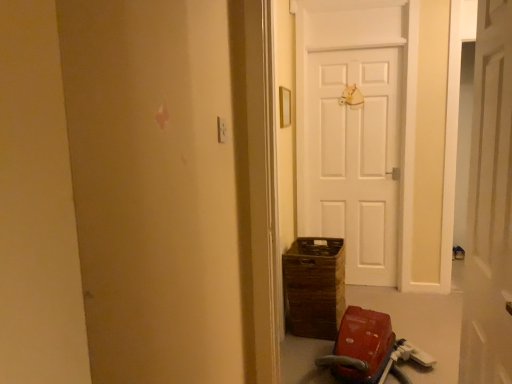
Locate an element on the screen. The width and height of the screenshot is (512, 384). red plastic baby carriage at lower right is located at coordinates (370, 349).

What do you see at coordinates (370, 349) in the screenshot?
I see `red plastic baby carriage at lower right` at bounding box center [370, 349].

The image size is (512, 384). In order to click on white matte door at center in this screenshot , I will do pyautogui.click(x=490, y=205).

This screenshot has width=512, height=384. Describe the element at coordinates (490, 205) in the screenshot. I see `white matte door at center` at that location.

This screenshot has height=384, width=512. What are the coordinates of `red plastic baby carriage at lower right` in the screenshot? It's located at (370, 349).

Does red plastic baby carriage at lower right appear on the right side of white matte door at center?

In fact, red plastic baby carriage at lower right is to the left of white matte door at center.

Considering the positions of objects red plastic baby carriage at lower right and white matte door at center in the image provided, who is in front, red plastic baby carriage at lower right or white matte door at center?

white matte door at center.

Between point (371, 337) and point (509, 192), which one is positioned behind?

The point (371, 337) is farther from the camera.

From the image's perspective, does red plastic baby carriage at lower right appear higher than white matte door at center?

Actually, red plastic baby carriage at lower right appears below white matte door at center in the image.

From a real-world perspective, is red plastic baby carriage at lower right on white matte door at center?

Incorrect, from a real-world perspective, red plastic baby carriage at lower right is lower than white matte door at center.

Considering the sizes of objects red plastic baby carriage at lower right and white matte door at center in the image provided, who is thinner, red plastic baby carriage at lower right or white matte door at center?

white matte door at center is thinner.

Who is taller, red plastic baby carriage at lower right or white matte door at center?

With more height is white matte door at center.

Is red plastic baby carriage at lower right smaller than white matte door at center?

Incorrect, red plastic baby carriage at lower right is not smaller in size than white matte door at center.

Would you say red plastic baby carriage at lower right is inside or outside white matte door at center?

red plastic baby carriage at lower right is located beyond the bounds of white matte door at center.

Are red plastic baby carriage at lower right and white matte door at center far apart?

Yes, red plastic baby carriage at lower right and white matte door at center are quite far apart.

Is red plastic baby carriage at lower right aimed at white matte door at center?

No, red plastic baby carriage at lower right does not turn towards white matte door at center.

Can you tell me how much red plastic baby carriage at lower right and white matte door at center differ in facing direction?

83.3 degrees separate the facing orientations of red plastic baby carriage at lower right and white matte door at center.

You are a GUI agent. You are given a task and a screenshot of the screen. Output one action in this format:
    pyautogui.click(x=<x>, y=<y>)
    Task: Click on the door positioned vertically above the red plastic baby carriage at lower right (from a real-world perspective)
    The image size is (512, 384).
    Given the screenshot: What is the action you would take?
    pyautogui.click(x=490, y=205)

In the scene shown: Is white matte door at center at the left side of red plastic baby carriage at lower right?

Incorrect, white matte door at center is not on the left side of red plastic baby carriage at lower right.

Considering the positions of objects white matte door at center and red plastic baby carriage at lower right in the image provided, who is behind, white matte door at center or red plastic baby carriage at lower right?

red plastic baby carriage at lower right is further away from the camera.

Which is in front, point (485, 368) or point (346, 360)?

The point (485, 368) is more forward.

From the image's perspective, is white matte door at center located above or below red plastic baby carriage at lower right?

Based on their image positions, white matte door at center is located above red plastic baby carriage at lower right.

From a real-world perspective, does white matte door at center sit lower than red plastic baby carriage at lower right?

No, from a real-world perspective, white matte door at center is not under red plastic baby carriage at lower right.

Which of these two, white matte door at center or red plastic baby carriage at lower right, is wider?

red plastic baby carriage at lower right is wider.

Does white matte door at center have a greater height compared to red plastic baby carriage at lower right?

Correct, white matte door at center is much taller as red plastic baby carriage at lower right.

Is white matte door at center smaller than red plastic baby carriage at lower right?

Yes.

Do you think white matte door at center is within red plastic baby carriage at lower right, or outside of it?

white matte door at center cannot be found inside red plastic baby carriage at lower right.

Are white matte door at center and red plastic baby carriage at lower right making contact?

No, white matte door at center is not beside red plastic baby carriage at lower right.

Is white matte door at center facing towards red plastic baby carriage at lower right?

No, white matte door at center is not oriented towards red plastic baby carriage at lower right.

Based on the photo, how different are the orientations of white matte door at center and red plastic baby carriage at lower right in degrees?

They differ by 83.3 degrees in their facing directions.

Locate an element on the screen. This screenshot has width=512, height=384. baby carriage behind the white matte door at center is located at coordinates (370, 349).

Find the location of a particular element. This screenshot has width=512, height=384. baby carriage below the white matte door at center (from a real-world perspective) is located at coordinates (370, 349).

The width and height of the screenshot is (512, 384). Find the location of `baby carriage below the white matte door at center (from the image's perspective)`. baby carriage below the white matte door at center (from the image's perspective) is located at coordinates (370, 349).